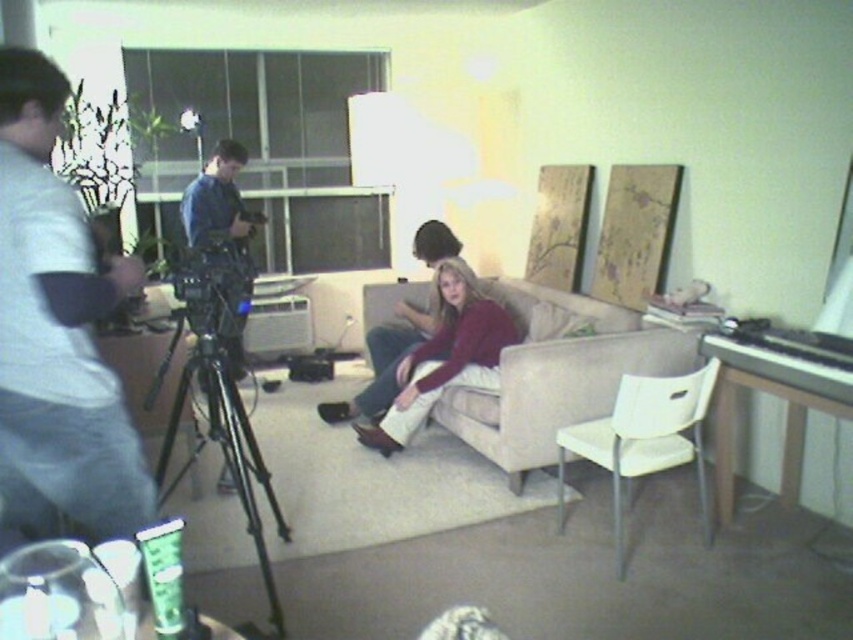
Which is more to the right, black matte tripod at lower left or black polished piano at right?

black polished piano at right

Is point (167, 422) behind point (734, 326)?

Yes, it is behind point (734, 326).

Which is in front, point (215, 406) or point (814, 362)?

Point (814, 362) is more forward.

I want to click on black matte tripod at lower left, so click(x=219, y=433).

Is white plastic chair at center below black matte tripod at lower left?

Yes, white plastic chair at center is below black matte tripod at lower left.

Does white plastic chair at center have a greater height compared to black matte tripod at lower left?

No, white plastic chair at center is not taller than black matte tripod at lower left.

Between point (703, 492) and point (207, 340), which one is positioned behind?

Positioned behind is point (703, 492).

Image resolution: width=853 pixels, height=640 pixels. I want to click on white plastic chair at center, so click(643, 440).

Does beige fabric couch at center appear on the left side of matte burgundy sweater at center?

In fact, beige fabric couch at center is to the right of matte burgundy sweater at center.

Is beige fabric couch at center below matte burgundy sweater at center?

No.

This screenshot has height=640, width=853. I want to click on beige fabric couch at center, so click(x=543, y=376).